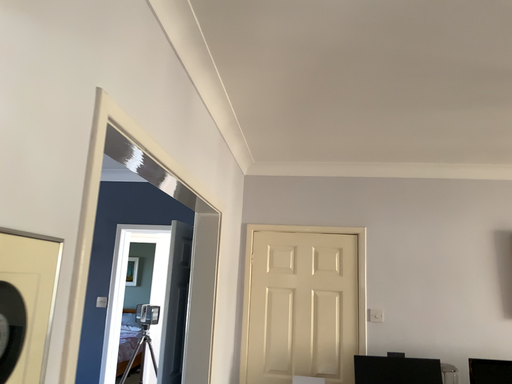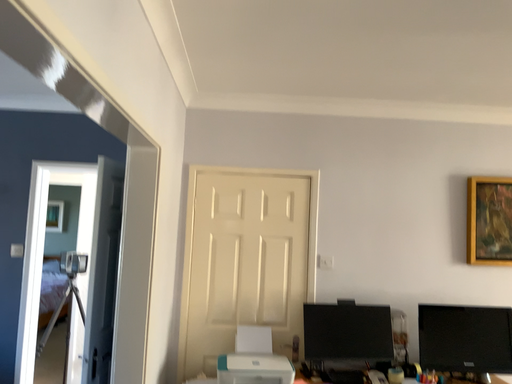
Question: Which way did the camera rotate in the video?

Choices:
 (A) rotated left
 (B) rotated right

Answer: (B)